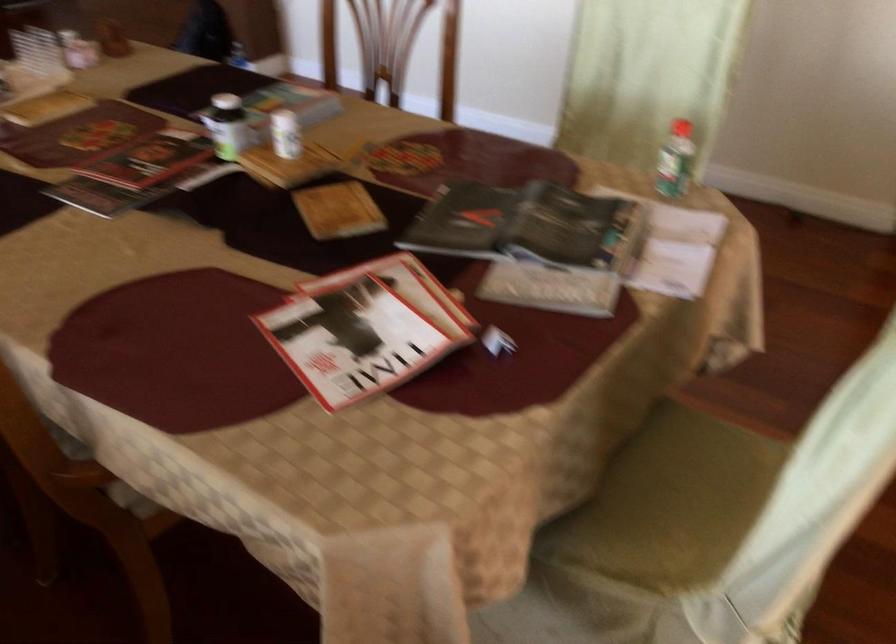
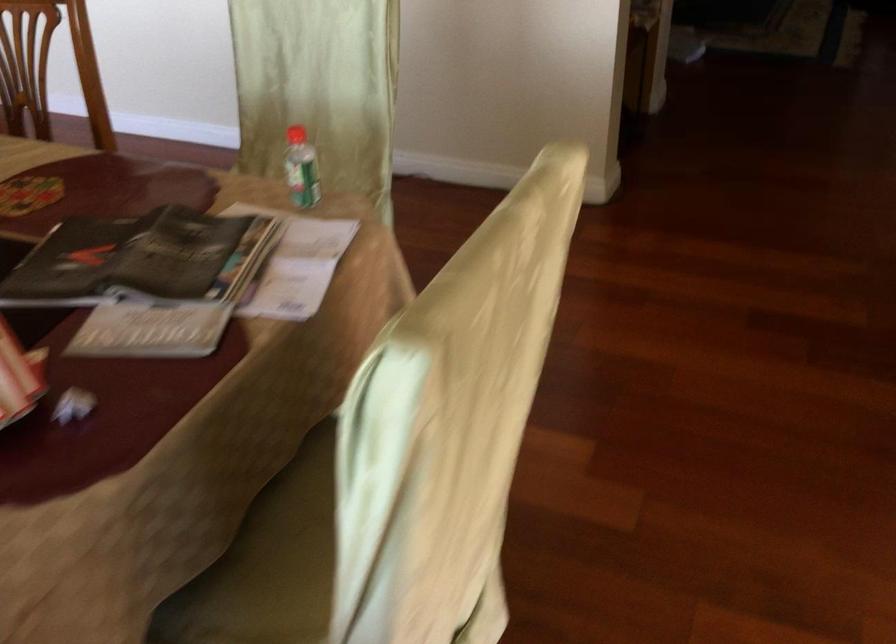
Question: The camera is either moving clockwise (left) or counter-clockwise (right) around the object. The first image is from the beginning of the video and the second image is from the end. Is the camera moving left or right when shooting the video?

Choices:
 (A) Left
 (B) Right

Answer: (A)